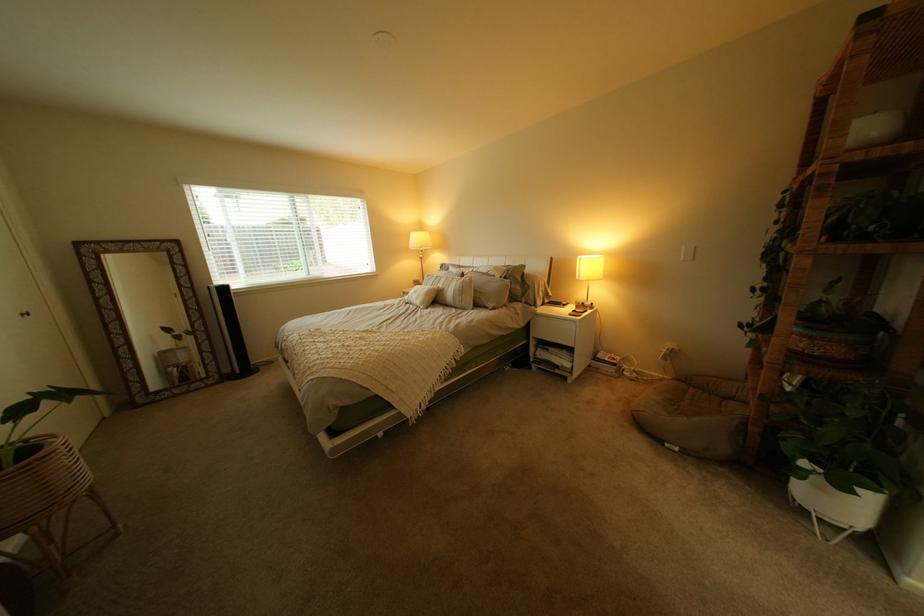
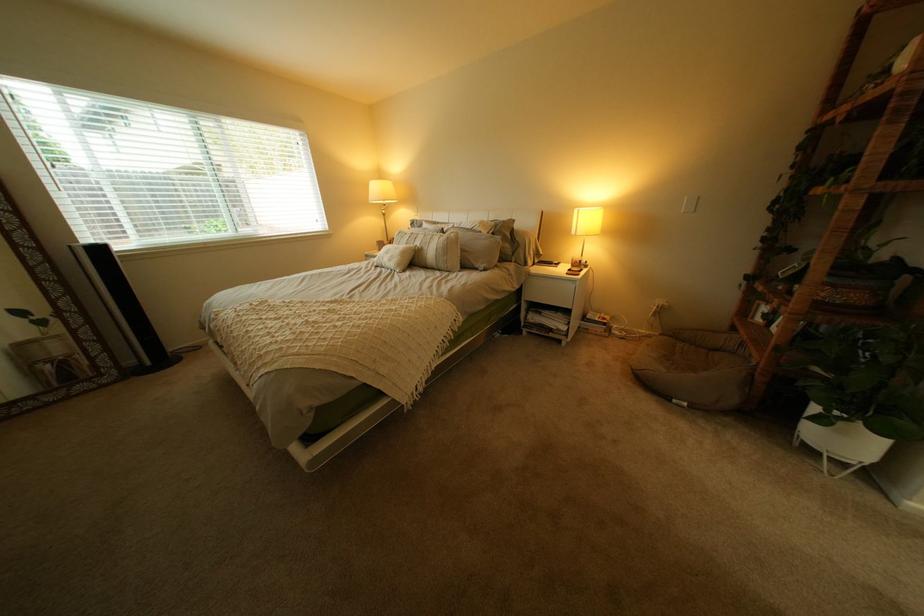
Question: Based on the continuous images, in which direction is the camera rotating? Reply with the corresponding letter.

Choices:
 (A) Left
 (B) Right
 (C) Up
 (D) Down

Answer: (B)